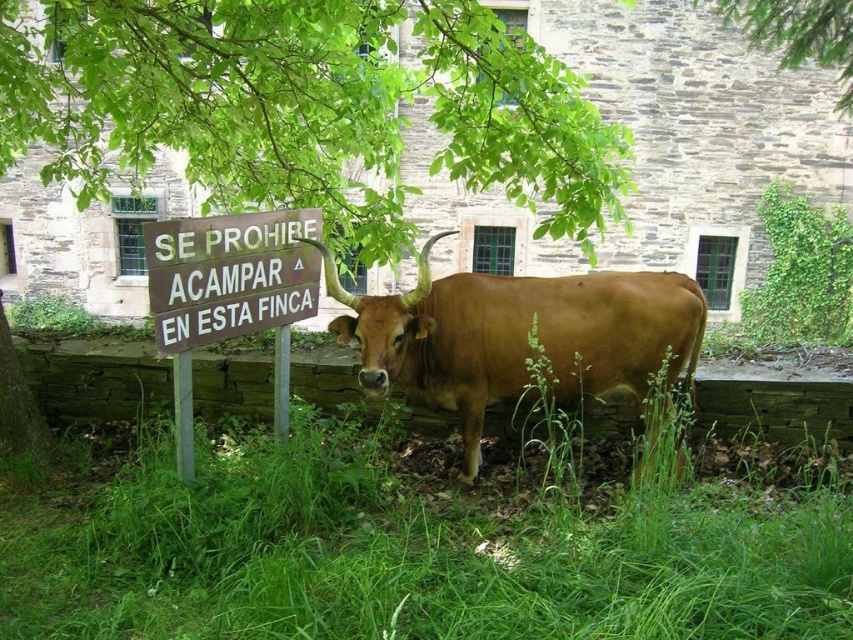
You are standing in the field and see the green grass at center and the brown glossy bull at center. Which object is positioned more to the left?

The green grass at center is positioned more to the left than the brown glossy bull at center.

You are a hiker who wants to know if the green grass at center is wider than the green leafy tree at upper center. Can you confirm this based on the scene?

The green grass at center is wider than the green leafy tree at upper center according to the description.